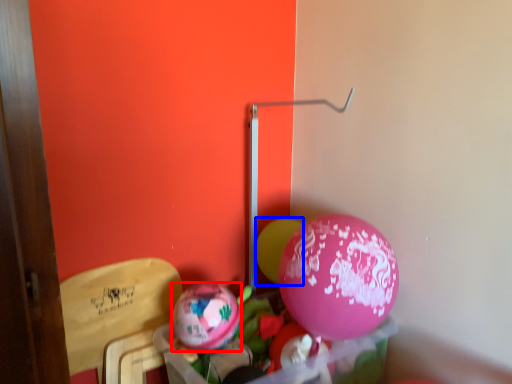
Question: Which of the following is the farthest to the observer, balloon (highlighted by a red box) or balloon (highlighted by a blue box)?

Choices:
 (A) balloon
 (B) balloon

Answer: (B)